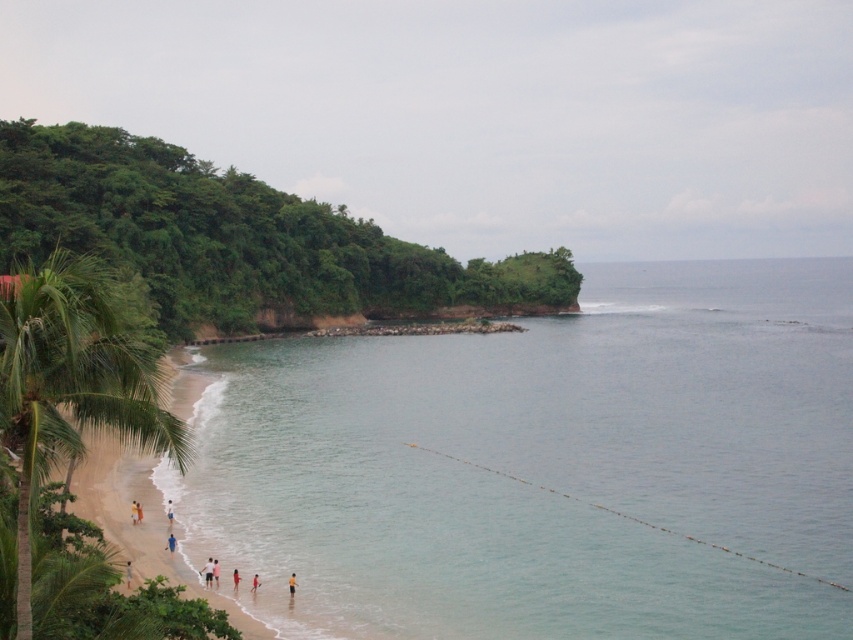
How distant is clear blue water at lower left from red fabric person at lower center?

84.68 meters

The height and width of the screenshot is (640, 853). Describe the element at coordinates (546, 465) in the screenshot. I see `clear blue water at lower left` at that location.

Measure the distance between clear blue water at lower left and camera.

They are 127.22 feet apart.

The height and width of the screenshot is (640, 853). In order to click on clear blue water at lower left in this screenshot , I will do `click(546, 465)`.

Does point (102, 396) come farther from viewer compared to point (170, 512)?

That is False.

Who is higher up, green leafy palm tree at left or white cotton shirt at lower left?

green leafy palm tree at left

From the picture: Who is more distant from viewer, [33,308] or [167,522]?

Positioned behind is point [167,522].

Locate an element on the screen. The image size is (853, 640). green leafy palm tree at left is located at coordinates (71, 385).

Does green leafy palm tree at left have a lesser height compared to reddish-orange fabric at lower center?

Incorrect, green leafy palm tree at left's height does not fall short of reddish-orange fabric at lower center's.

Who is positioned more to the left, green leafy palm tree at left or reddish-orange fabric at lower center?

green leafy palm tree at left

Where is `green leafy palm tree at left`? This screenshot has height=640, width=853. green leafy palm tree at left is located at coordinates (71, 385).

What are the coordinates of `green leafy palm tree at left` in the screenshot? It's located at (71, 385).